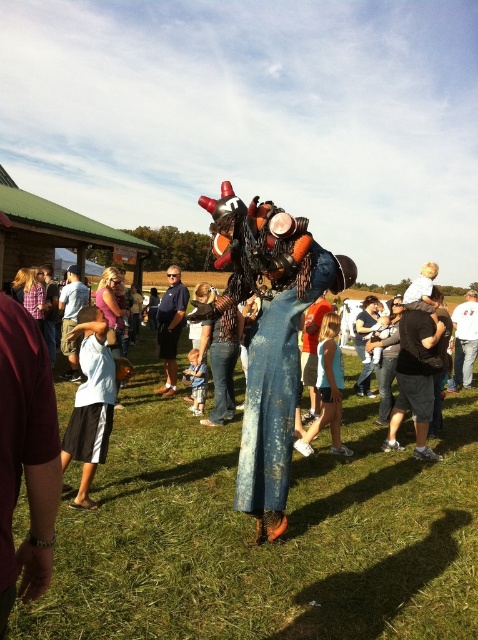
You are standing in the outdoor scene and want to walk towards the green grass at center. Which direction should you move relative to the white cotton shirt at lower left?

The green grass at center is in front of the white cotton shirt at lower left, so you should move forward towards the green grass at center.

You are a photographer trying to capture a closeup of the white cotton shirt at lower left and the denim jeans at center. Which one should you zoom in on more to ensure both are in focus?

The white cotton shirt at lower left has a smaller size compared to denim jeans at center, so you should zoom in more on the white cotton shirt at lower left to ensure both are in focus.

You are a photographer trying to capture a photo of the dark blue jeans at center and denim jeans at center. Which one should you focus on first if you want to include both in your frame without moving the camera?

The dark blue jeans at center is much taller than the denim jeans at center, so you should focus on the dark blue jeans at center first to ensure it fits properly in the frame.